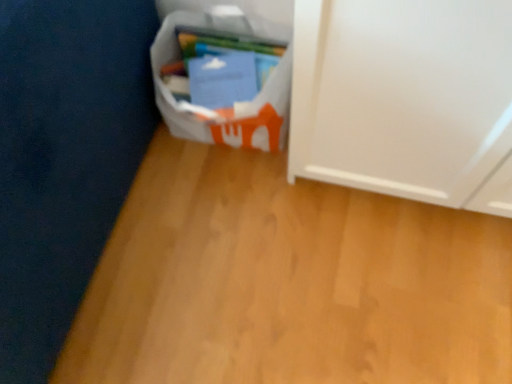
Question: Should I look upward or downward to see white paper at lower left?

Choices:
 (A) down
 (B) up

Answer: (B)